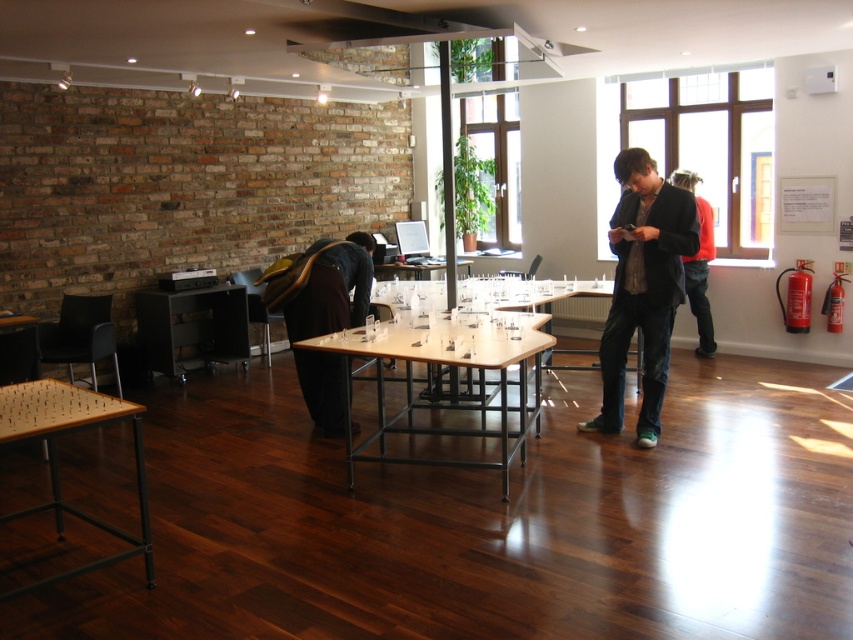
Is dark brown leather jacket at center bigger than clear plastic table at center?

Yes, dark brown leather jacket at center is bigger than clear plastic table at center.

Between dark brown leather jacket at center and clear plastic table at center, which one is positioned higher?

clear plastic table at center

Who is more distant from viewer, (695,260) or (438,268)?

The point (438,268) is behind.

Image resolution: width=853 pixels, height=640 pixels. Identify the location of dark brown leather jacket at center. (698, 264).

Is matte black jacket at center bigger than dark brown leather jacket at center?

Indeed, matte black jacket at center has a larger size compared to dark brown leather jacket at center.

Between matte black jacket at center and dark brown leather jacket at center, which one is positioned higher?

dark brown leather jacket at center is higher up.

Is point (602, 412) farther from viewer compared to point (701, 246)?

No, (602, 412) is closer to viewer.

You are a GUI agent. You are given a task and a screenshot of the screen. Output one action in this format:
    pyautogui.click(x=<x>, y=<y>)
    Task: Click on the matte black jacket at center
    
    Given the screenshot: What is the action you would take?
    pyautogui.click(x=643, y=289)

Between point (444, 362) and point (196, 321), which one is positioned in front?

Point (444, 362)

Is the position of light brown wooden table at center more distant than that of black matte table at center?

No, it is in front of black matte table at center.

Identify the location of light brown wooden table at center. (456, 388).